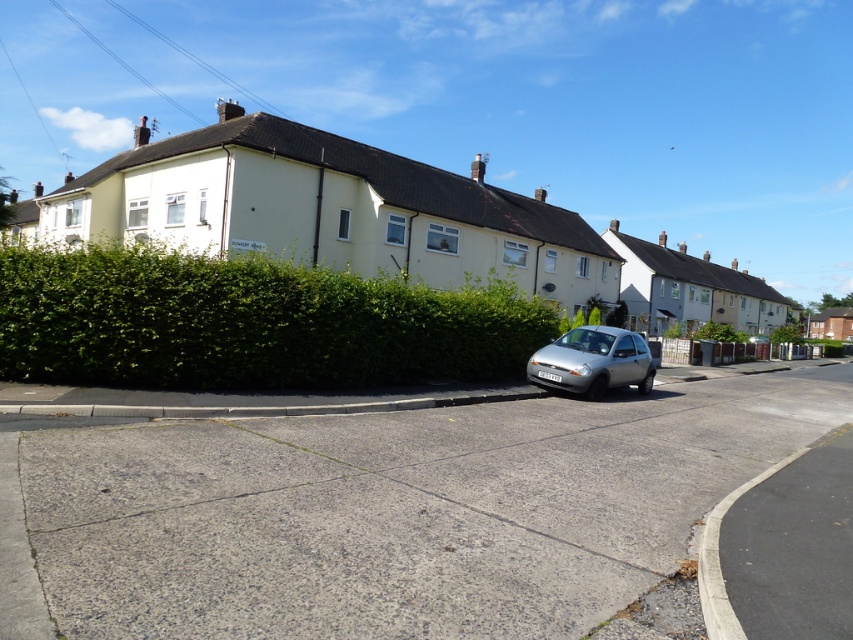
Is green leafy hedge at center positioned in front of silver metallic hatchback at center?

Yes, green leafy hedge at center is in front of silver metallic hatchback at center.

Is green leafy hedge at center thinner than silver metallic hatchback at center?

No.

I want to click on green leafy hedge at center, so click(248, 323).

Where is `green leafy hedge at center`? green leafy hedge at center is located at coordinates (248, 323).